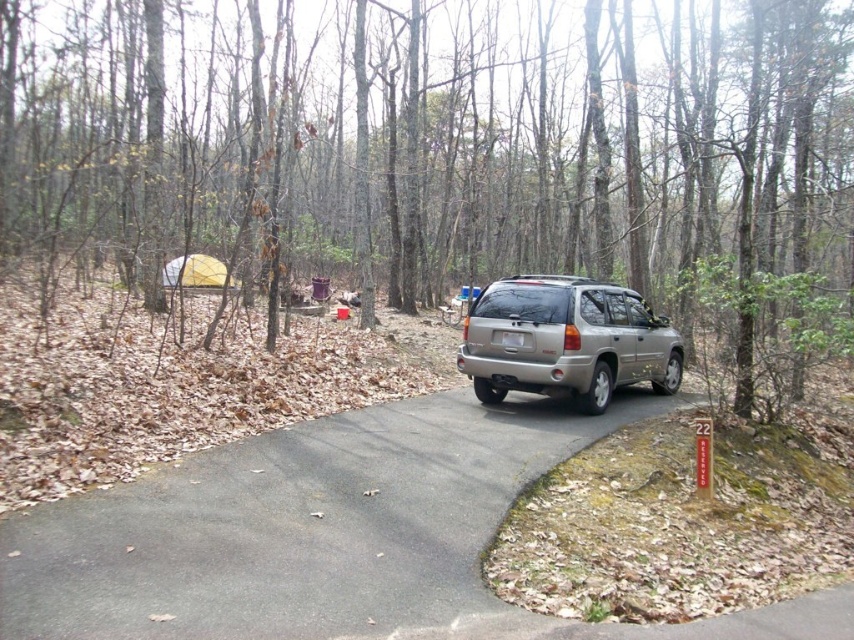
Question: Is gray asphalt road at center bigger than silver metallic suv at center?

Choices:
 (A) no
 (B) yes

Answer: (A)

Question: Which object is positioned farthest from the silver metallic suv at center?

Choices:
 (A) gray asphalt road at center
 (B) brown bark tree at center

Answer: (B)

Question: Does brown bark tree at center have a lesser width compared to silver metallic suv at center?

Choices:
 (A) yes
 (B) no

Answer: (B)

Question: Which of these objects is positioned farthest from the gray asphalt road at center?

Choices:
 (A) silver metallic suv at center
 (B) brown bark tree at center

Answer: (B)

Question: Which object is closer to the camera taking this photo?

Choices:
 (A) brown bark tree at center
 (B) gray asphalt road at center

Answer: (B)

Question: Can you confirm if brown bark tree at center is smaller than silver metallic suv at center?

Choices:
 (A) no
 (B) yes

Answer: (A)